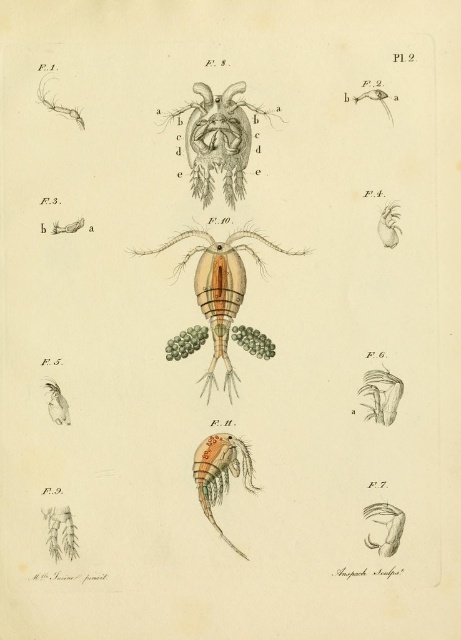
Question: Does translucent yellowish-orange shrimp at center lie in front of matte white insect at lower left?

Choices:
 (A) yes
 (B) no

Answer: (B)

Question: Can you confirm if translucent yellowish-orange shrimp at center is bigger than matte white insect at lower left?

Choices:
 (A) yes
 (B) no

Answer: (A)

Question: Which object appears farthest from the camera in this image?

Choices:
 (A) matte white insect at lower left
 (B) translucent orange shrimp at lower center

Answer: (A)

Question: Is translucent orange shrimp at lower center bigger than matte yellow insect at upper right?

Choices:
 (A) yes
 (B) no

Answer: (A)

Question: Which of the following is the closest to the observer?

Choices:
 (A) translucent beige heart at center
 (B) matte white insect at lower left
 (C) translucent yellowish-orange shrimp at center

Answer: (A)

Question: Which of the following is the closest to the observer?

Choices:
 (A) translucent yellowish-orange shrimp at center
 (B) translucent beige heart at center

Answer: (B)